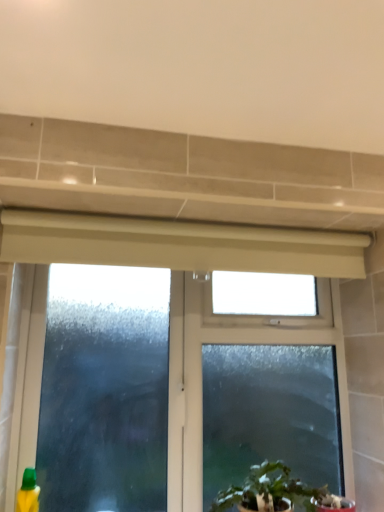
Question: Considering the positions of green leafy plant at lower center and green plastic bottle at lower left in the image, is green leafy plant at lower center taller or shorter than green plastic bottle at lower left?

Choices:
 (A) tall
 (B) short

Answer: (B)

Question: Considering the positions of point (244, 480) and point (24, 510), is point (244, 480) closer or farther from the camera than point (24, 510)?

Choices:
 (A) closer
 (B) farther

Answer: (B)

Question: Based on their relative distances, which object is nearer to the green plastic bottle at lower left?

Choices:
 (A) frosted glass window at center
 (B) green leafy plant at lower center

Answer: (A)

Question: Which is farther from the frosted glass window at center?

Choices:
 (A) green leafy plant at lower center
 (B) green plastic bottle at lower left

Answer: (B)